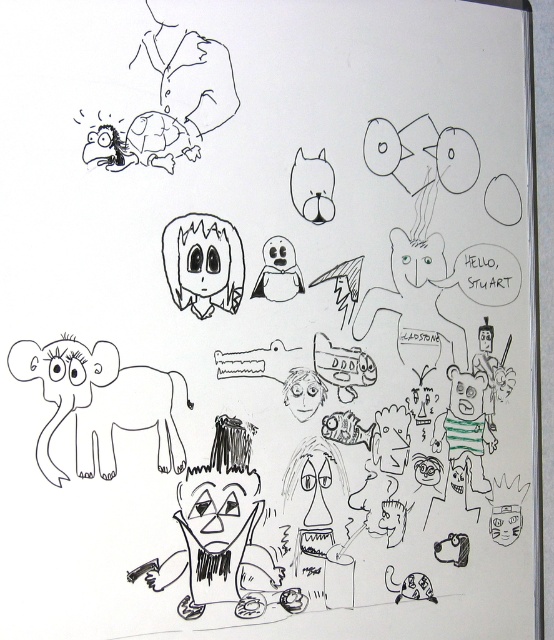
Question: Is matte black elephant at lower left above matte black cat at center?

Choices:
 (A) yes
 (B) no

Answer: (B)

Question: Can you confirm if matte black elephant at lower left is positioned to the right of black line art face at center?

Choices:
 (A) yes
 (B) no

Answer: (B)

Question: Which point is closer to the camera?

Choices:
 (A) [x=179, y=296]
 (B) [x=34, y=362]
 (C) [x=320, y=173]

Answer: (B)

Question: Among these points, which one is farthest from the camera?

Choices:
 (A) [235, 310]
 (B) [99, 394]
 (C) [314, 195]

Answer: (C)

Question: Is matte black elephant at lower left wider than matte black cat at center?

Choices:
 (A) no
 (B) yes

Answer: (B)

Question: Which point is farther to the camera?

Choices:
 (A) (114, 458)
 (B) (316, 173)
 (C) (230, 298)

Answer: (B)